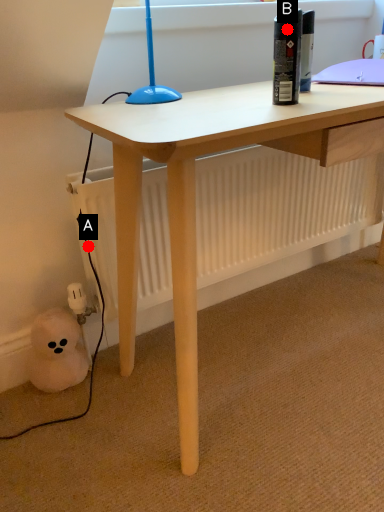
Question: Two points are circled on the image, labeled by A and B beside each circle. Among these points, which one is farthest from the camera?

Choices:
 (A) A is further
 (B) B is further

Answer: (A)